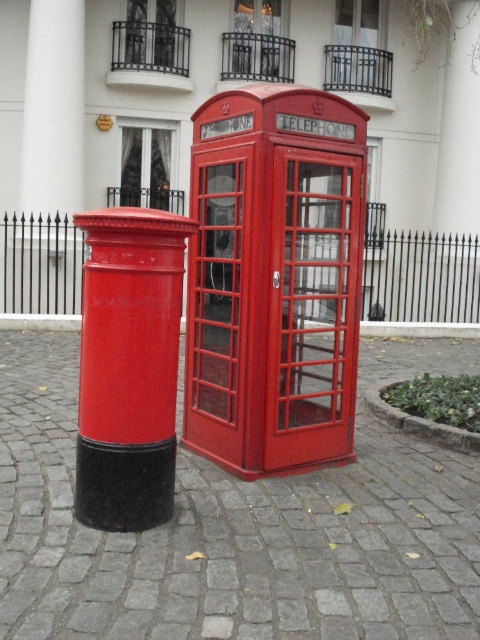
You are standing at the center of the cobblestone street and want to place a new bench exactly halfway between the matte red postbox at center and the telephone booth on the right. What are the coordinates of the point where the bench should be placed?

The coordinates of the bench placement would be the midpoint between the matte red postbox at center at point (129, 365) and the telephone booth on the right. Since the telephone booth is on the right side of the frame, its coordinates would be higher in the x or y axis depending on the coordinate system. However, without knowing the exact coordinates of the telephone booth, it is impossible to calculate the midpoint. Please provide the coordinates of the telephone booth to determine the bench location.